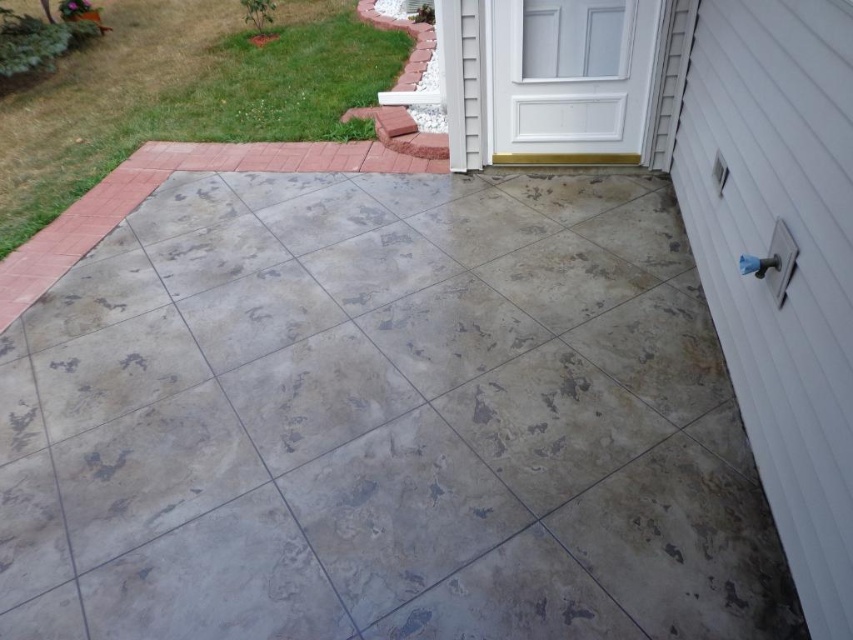
Question: Does gray concrete at center have a smaller size compared to gray concrete patio at upper left?

Choices:
 (A) yes
 (B) no

Answer: (A)

Question: Is gray concrete at center smaller than gray concrete patio at upper left?

Choices:
 (A) yes
 (B) no

Answer: (A)

Question: Can you confirm if gray concrete at center is smaller than gray concrete patio at upper left?

Choices:
 (A) no
 (B) yes

Answer: (B)